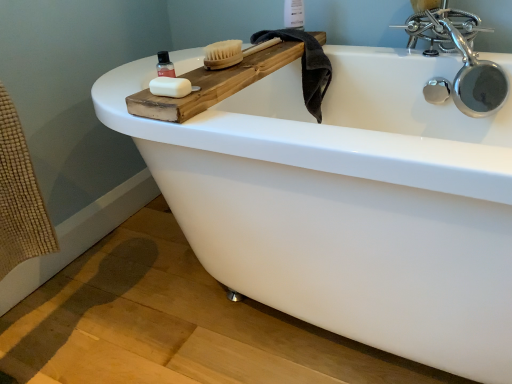
Locate an element on the screen. Image resolution: width=512 pixels, height=384 pixels. dark gray towel at upper right is located at coordinates (305, 65).

What do you see at coordinates (305, 65) in the screenshot?
I see `dark gray towel at upper right` at bounding box center [305, 65].

What is the approximate height of translucent plastic bottle at upper left?

The height of translucent plastic bottle at upper left is 2.85 inches.

This screenshot has height=384, width=512. Describe the element at coordinates (165, 65) in the screenshot. I see `translucent plastic bottle at upper left` at that location.

Where is `natural wood brush at upper center`? This screenshot has height=384, width=512. natural wood brush at upper center is located at coordinates (232, 52).

Locate an element on the screen. The height and width of the screenshot is (384, 512). white plastic bottle at upper center is located at coordinates (294, 14).

Which of these two, white matte soap at upper left or translucent plastic bottle at upper left, stands taller?

translucent plastic bottle at upper left is taller.

Could you tell me if white matte soap at upper left is facing translucent plastic bottle at upper left?

No, white matte soap at upper left is not turned towards translucent plastic bottle at upper left.

Is the depth of white matte soap at upper left less than that of translucent plastic bottle at upper left?

Yes, white matte soap at upper left is closer to the viewer.

Which object is closer to the camera taking this photo, white plastic bottle at upper center or polished chrome faucet at upper right?

Positioned in front is polished chrome faucet at upper right.

The image size is (512, 384). I want to click on toiletry on the left of polished chrome faucet at upper right, so click(x=294, y=14).

From a real-world perspective, which object stands above the other?

white plastic bottle at upper center is physically above.

Considering the relative positions of white plastic bottle at upper center and polished chrome faucet at upper right in the image provided, is white plastic bottle at upper center to the right of polished chrome faucet at upper right from the viewer's perspective?

In fact, white plastic bottle at upper center is to the left of polished chrome faucet at upper right.

Considering the relative positions of natural wood brush at upper center and white plastic bottle at upper center in the image provided, is natural wood brush at upper center to the left of white plastic bottle at upper center from the viewer's perspective?

Indeed, natural wood brush at upper center is positioned on the left side of white plastic bottle at upper center.

From the image's perspective, relative to white plastic bottle at upper center, is natural wood brush at upper center above or below?

Based on their image positions, natural wood brush at upper center is located beneath white plastic bottle at upper center.

From the picture: Who is bigger, natural wood brush at upper center or white plastic bottle at upper center?

natural wood brush at upper center.

Is natural wood brush at upper center placed right next to white plastic bottle at upper center?

natural wood brush at upper center and white plastic bottle at upper center are clearly separated.

Does point (306, 95) lie in front of point (453, 47)?

No, (306, 95) is further to viewer.

Is dark gray towel at upper right situated inside polished chrome faucet at upper right or outside?

dark gray towel at upper right exists outside the volume of polished chrome faucet at upper right.

From the image's perspective, which one is positioned lower, dark gray towel at upper right or polished chrome faucet at upper right?

dark gray towel at upper right, from the image's perspective.

Does polished chrome faucet at upper right have a lesser width compared to translucent plastic bottle at upper left?

No.

From a real-world perspective, is polished chrome faucet at upper right above or below translucent plastic bottle at upper left?

Clearly, from a real-world perspective, polished chrome faucet at upper right is below translucent plastic bottle at upper left.

Considering the positions of objects polished chrome faucet at upper right and translucent plastic bottle at upper left in the image provided, who is in front, polished chrome faucet at upper right or translucent plastic bottle at upper left?

translucent plastic bottle at upper left is more forward.

At what (x,y) coordinates should I click in order to perform the action: click on tap that is above the translucent plastic bottle at upper left (from the image's perspective). Please return your answer as a coordinate pair (x, y). Looking at the image, I should click on (463, 61).

Is white plastic bottle at upper center turned away from translucent plastic bottle at upper left?

No, white plastic bottle at upper center is not facing away from translucent plastic bottle at upper left.

Consider the image. Is white plastic bottle at upper center further to the viewer compared to translucent plastic bottle at upper left?

That is True.

Is white plastic bottle at upper center next to translucent plastic bottle at upper left and touching it?

No, white plastic bottle at upper center is not touching translucent plastic bottle at upper left.

From a real-world perspective, which object rests below the other?

In real-world perspective, translucent plastic bottle at upper left is lower.

Which object is positioned more to the right, dark gray towel at upper right or translucent plastic bottle at upper left?

dark gray towel at upper right is more to the right.

From a real-world perspective, is dark gray towel at upper right positioned above or below translucent plastic bottle at upper left?

From a real-world perspective, dark gray towel at upper right is physically below translucent plastic bottle at upper left.

How distant is dark gray towel at upper right from translucent plastic bottle at upper left?

They are 19.46 inches apart.

Where is `soap below the translucent plastic bottle at upper left (from the image's perspective)`? soap below the translucent plastic bottle at upper left (from the image's perspective) is located at coordinates (170, 87).

Identify the location of tap in front of the white plastic bottle at upper center. (463, 61).

From the image, which object appears to be farther from polished chrome faucet at upper right, translucent plastic bottle at upper left or dark gray towel at upper right?

translucent plastic bottle at upper left is positioned further to the anchor polished chrome faucet at upper right.

Considering their positions, is translucent plastic bottle at upper left positioned closer to white matte soap at upper left than white plastic bottle at upper center?

translucent plastic bottle at upper left lies closer to white matte soap at upper left than the other object.

Looking at this image, looking at the image, which one is located further to natural wood brush at upper center, white plastic bottle at upper center or white matte soap at upper left?

The object further to natural wood brush at upper center is white plastic bottle at upper center.

Based on their spatial positions, is translucent plastic bottle at upper left or white plastic bottle at upper center further from natural wood brush at upper center?

white plastic bottle at upper center is positioned further to the anchor natural wood brush at upper center.

When comparing their distances from natural wood brush at upper center, does white plastic bottle at upper center or polished chrome faucet at upper right seem closer?

white plastic bottle at upper center is closer to natural wood brush at upper center.

Based on their spatial positions, is dark gray towel at upper right or natural wood brush at upper center further from white matte soap at upper left?

dark gray towel at upper right is further to white matte soap at upper left.

Considering their positions, is white plastic bottle at upper center positioned closer to translucent plastic bottle at upper left than natural wood brush at upper center?

natural wood brush at upper center lies closer to translucent plastic bottle at upper left than the other object.

Looking at the image, which one is located further to dark gray towel at upper right, white matte soap at upper left or translucent plastic bottle at upper left?

Based on the image, white matte soap at upper left appears to be further to dark gray towel at upper right.

Where is `bath towel located between natural wood brush at upper center and white plastic bottle at upper center in the depth direction`? This screenshot has height=384, width=512. bath towel located between natural wood brush at upper center and white plastic bottle at upper center in the depth direction is located at coordinates (305, 65).

Where is `mouthwash located between white matte soap at upper left and white plastic bottle at upper center in the depth direction`? The width and height of the screenshot is (512, 384). mouthwash located between white matte soap at upper left and white plastic bottle at upper center in the depth direction is located at coordinates (165, 65).

I want to click on bath towel between white matte soap at upper left and white plastic bottle at upper center along the z-axis, so click(x=305, y=65).

The width and height of the screenshot is (512, 384). Find the location of `toiletry between translucent plastic bottle at upper left and polished chrome faucet at upper right in the horizontal direction`. toiletry between translucent plastic bottle at upper left and polished chrome faucet at upper right in the horizontal direction is located at coordinates (294, 14).